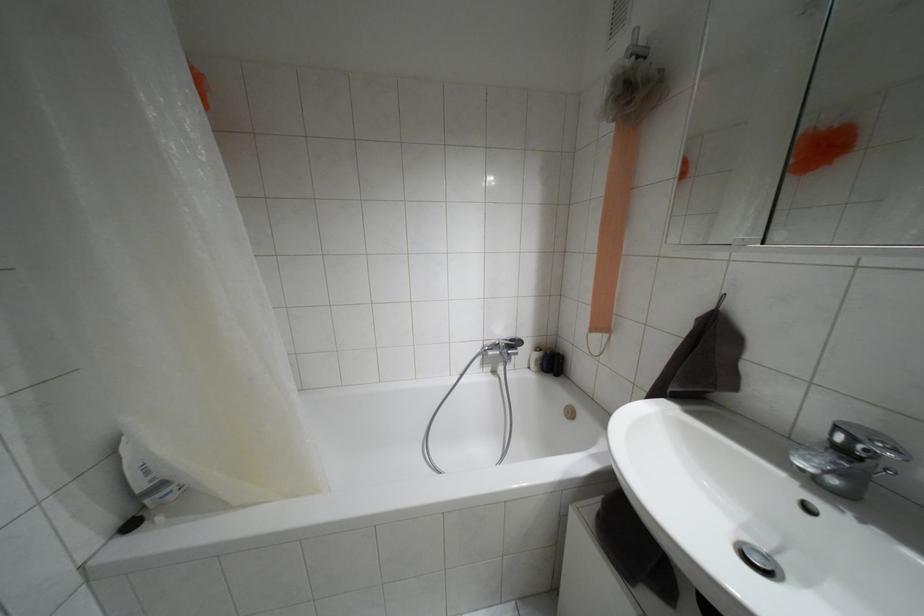
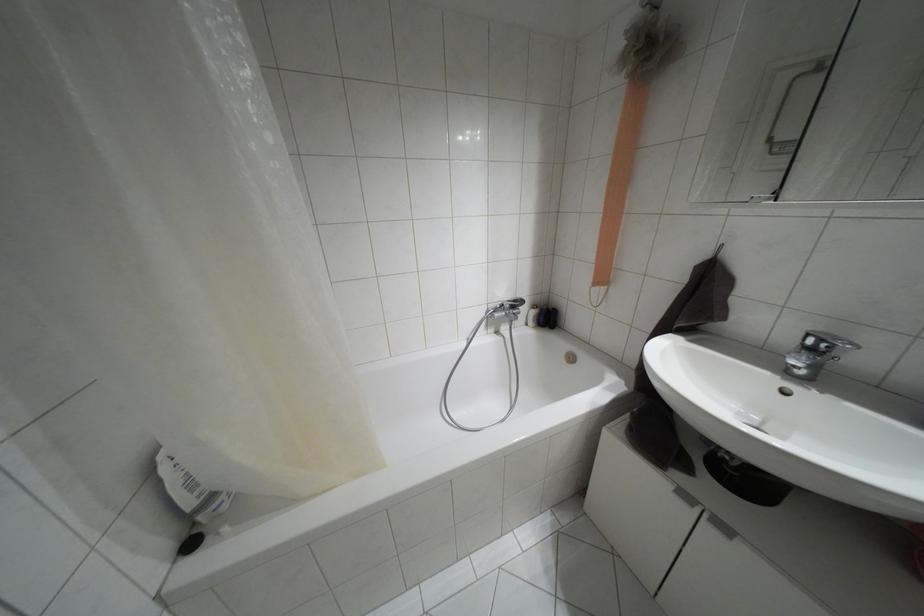
Find the pixel in the second image that matches [511,339] in the first image.

(514, 301)